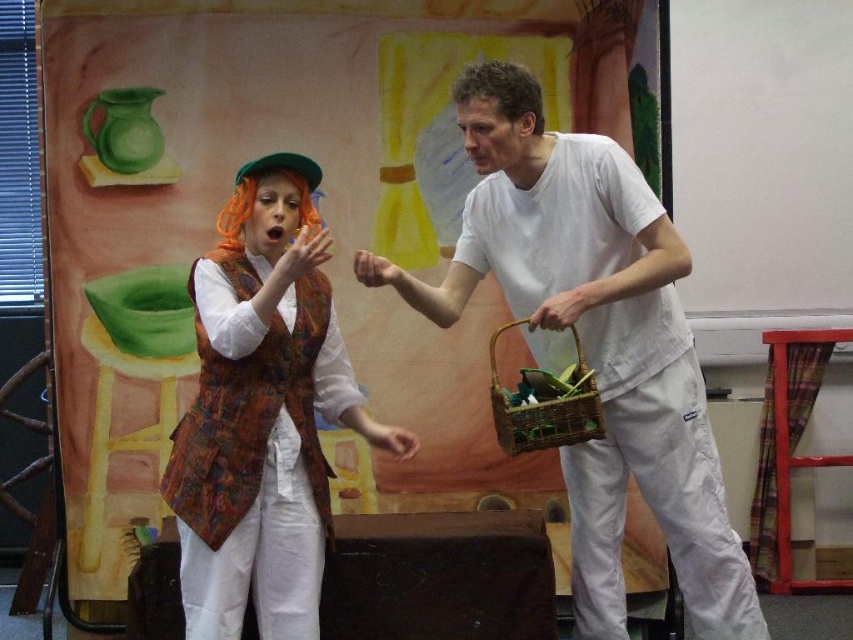
Question: Which of the following is the farthest from the observer?

Choices:
 (A) woven brown basket at right
 (B) white matte shirt at center

Answer: (A)

Question: Which point is closer to the camera?

Choices:
 (A) (550, 436)
 (B) (585, 308)
 (C) (233, 624)

Answer: (C)

Question: Is printed fabric vest at center wider than woven brown basket at right?

Choices:
 (A) no
 (B) yes

Answer: (B)

Question: Considering the real-world distances, which object is farthest from the printed fabric vest at center?

Choices:
 (A) woven brown basket at right
 (B) white matte shirt at center

Answer: (A)

Question: Can you confirm if white matte shirt at center is thinner than printed fabric vest at center?

Choices:
 (A) no
 (B) yes

Answer: (A)

Question: Can you confirm if white matte shirt at center is positioned to the right of woven brown basket at right?

Choices:
 (A) no
 (B) yes

Answer: (B)